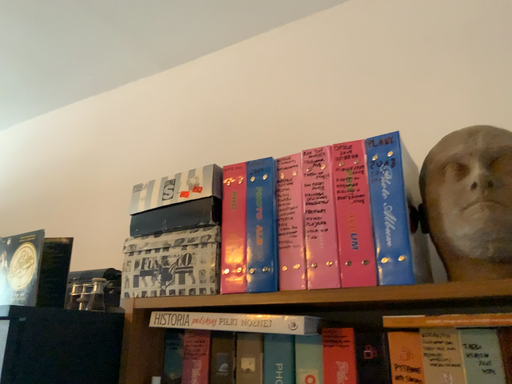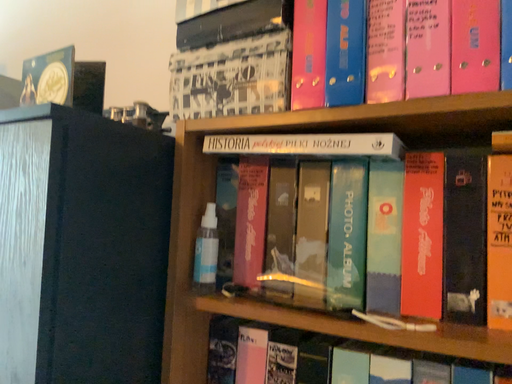
Question: How did the camera likely rotate when shooting the video?

Choices:
 (A) rotated upward
 (B) rotated downward

Answer: (B)